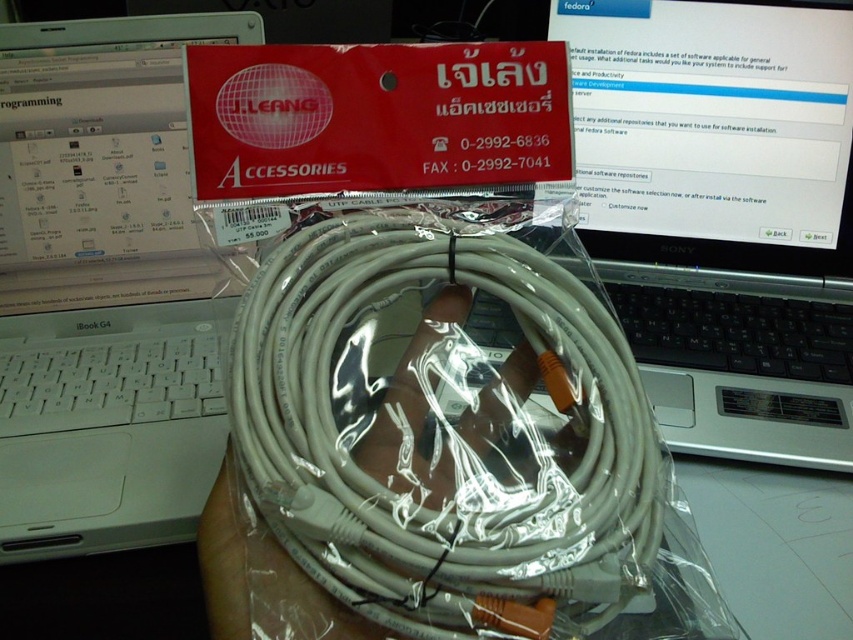
Question: Is the position of silver metallic laptop at upper right less distant than that of white plastic laptop at center?

Choices:
 (A) no
 (B) yes

Answer: (A)

Question: Which point is closer to the camera?

Choices:
 (A) (679, 22)
 (B) (277, 492)
 (C) (131, 388)

Answer: (B)

Question: Is white plastic cable at center smaller than silver metallic laptop at upper right?

Choices:
 (A) no
 (B) yes

Answer: (B)

Question: Which point is closer to the camera?

Choices:
 (A) [148, 362]
 (B) [599, 516]
 (C) [698, 387]

Answer: (B)

Question: Based on their relative distances, which object is nearer to the white plastic laptop at center?

Choices:
 (A) white plastic cable at center
 (B) silver metallic laptop at upper right

Answer: (A)

Question: In this image, where is white plastic cable at center located relative to silver metallic laptop at upper right?

Choices:
 (A) right
 (B) left

Answer: (B)